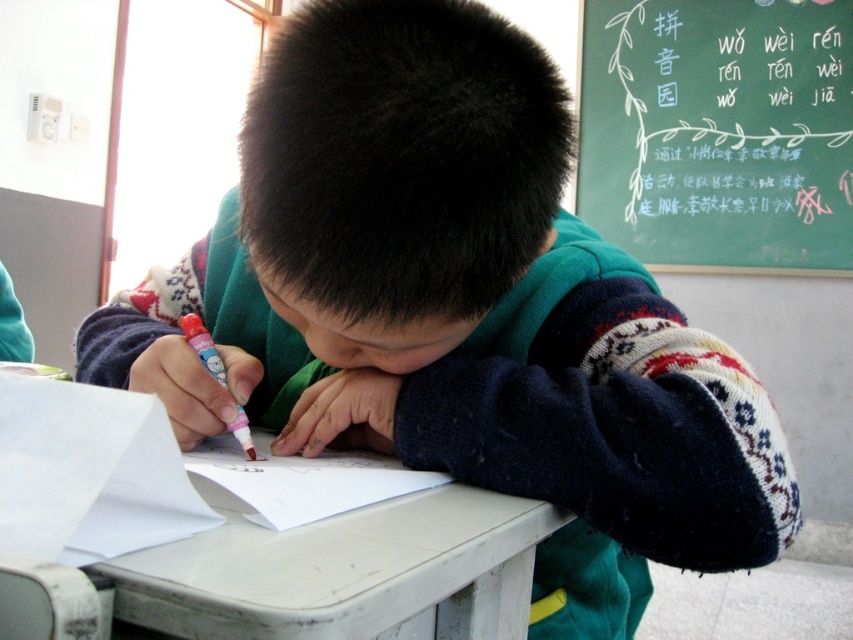
You are a teacher observing a classroom scene. You notice the green chalkboard at upper right and the white paper at lower left. Which object takes up more space in the image?

The green chalkboard at upper right has a larger size compared to the white paper at lower left, so it takes up more space in the image.

You are a teacher trying to arrange desks in a classroom. The white matte table at center is placed at coordinates point 0.892, 0.402. If you want to place a new desk exactly 0.1 units to the right of it, what would be the new coordinates?

The new coordinates would be 0.892 plus 0.1 equals 0.992, so the new position is point (x=341, y=634).

You are a teacher observing a student in a classroom. The student is sitting at a desk and focused on drawing. The desk has coordinates at point (x=341, y=570). If you want to place a new drawing tool on the desk, will it fit if the tool requires 0.1 units of space?

The white matte table at center is located at point (x=341, y=570). Since the tool requires 0.1 units of space and the coordinates indicate the desk is at that point, the tool should fit as long as the desk has enough space at that specific location. However, the description does not provide the desk dimensions, so we can only confirm the location matches the desk coordinates.